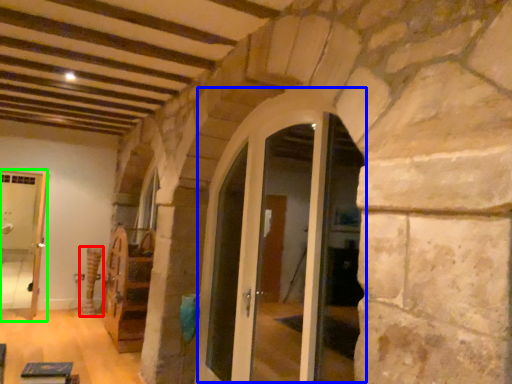
Question: Which object is the farthest from pillar (highlighted by a red box)? Choose among these: glass door (highlighted by a blue box) or passage (highlighted by a green box).

Choices:
 (A) glass door
 (B) passage

Answer: (A)